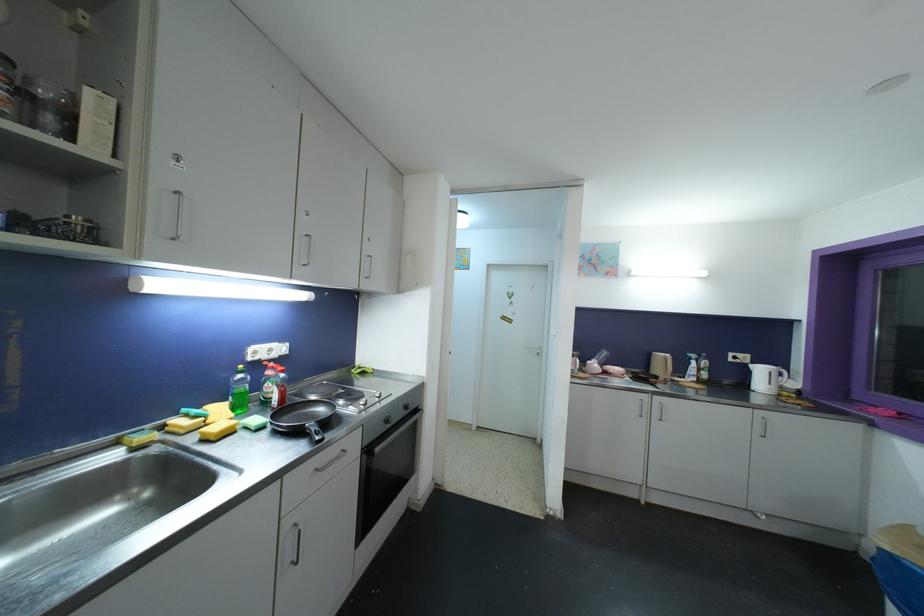
At what (x,y) coordinates should I click in order to perform the action: click on frying pan handle. Please return your answer as a coordinate pair (x, y). Looking at the image, I should click on (313, 432).